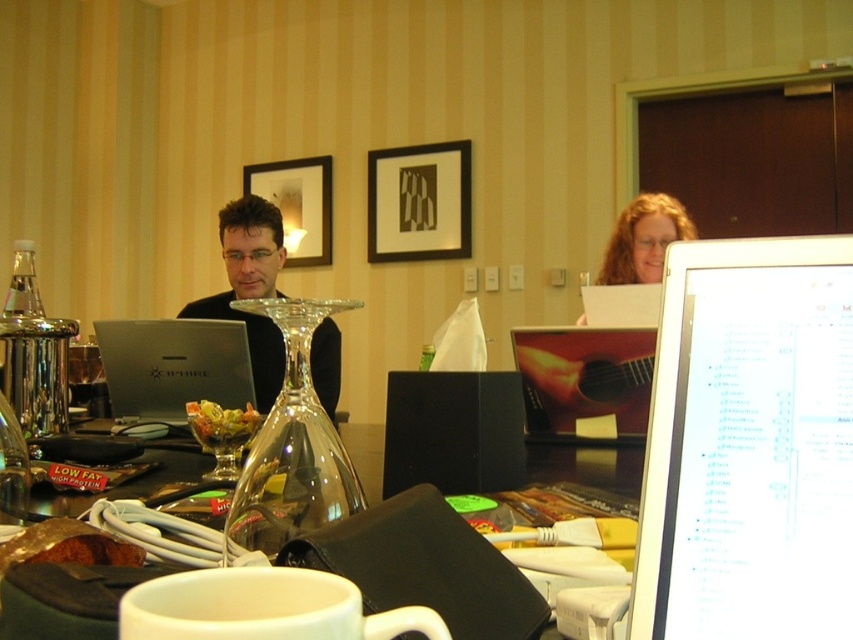
Where is `matte black laptop at center`? This screenshot has width=853, height=640. matte black laptop at center is located at coordinates (250, 288).

Who is more forward, (273, 330) or (212, 403)?

Positioned in front is point (212, 403).

Locate an element on the screen. This screenshot has width=853, height=640. matte black laptop at center is located at coordinates (250, 288).

Does silver metallic laptop at center have a greater width compared to green leafy salad at center?

Correct, the width of silver metallic laptop at center exceeds that of green leafy salad at center.

In the scene shown: Can you confirm if silver metallic laptop at center is positioned to the right of green leafy salad at center?

Incorrect, silver metallic laptop at center is not on the right side of green leafy salad at center.

The height and width of the screenshot is (640, 853). Identify the location of silver metallic laptop at center. (172, 365).

Which of these two, white glossy computer monitor at upper right or green leafy salad at center, stands shorter?

green leafy salad at center

The image size is (853, 640). Describe the element at coordinates (749, 445) in the screenshot. I see `white glossy computer monitor at upper right` at that location.

Does point (775, 452) come farther from viewer compared to point (195, 420)?

No, it is not.

The height and width of the screenshot is (640, 853). In order to click on white glossy computer monitor at upper right in this screenshot , I will do `click(749, 445)`.